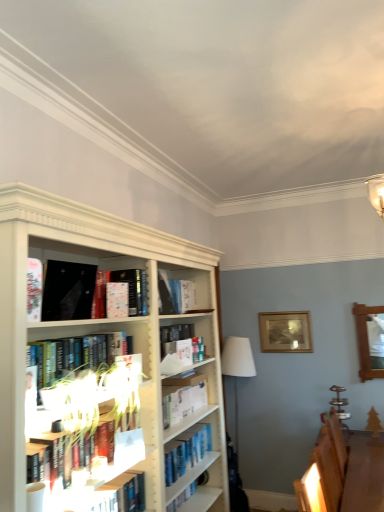
Describe the element at coordinates (285, 332) in the screenshot. I see `wooden picture frame at upper center` at that location.

Find the location of `hardcover book at center, which is the 3th book from top to bottom`. hardcover book at center, which is the 3th book from top to bottom is located at coordinates (118, 446).

Image resolution: width=384 pixels, height=512 pixels. What do you see at coordinates (127, 291) in the screenshot?
I see `hardcover book at center, which is the first book in top-to-bottom order` at bounding box center [127, 291].

Identify the location of white matte bookshelf at left, which appears as the 2th book when ordered from the bottom. (79, 355).

At what (x,y) coordinates should I click in order to perform the action: click on wooden table at lower right. Please return your answer as a coordinate pair (x, y). The image size is (384, 512). Looking at the image, I should click on (364, 472).

Find the location of `matte white paperback book at center, which ranks as the second paperback book in front-to-back order`. matte white paperback book at center, which ranks as the second paperback book in front-to-back order is located at coordinates point(117,298).

Is point (61, 276) closer or farther from the camera than point (246, 370)?

Point (61, 276).

Does matte black book at upper left, the second paperback book in the back-to-front sequence, turn towards white fabric lampshade at center?

No, matte black book at upper left, the second paperback book in the back-to-front sequence, is not aimed at white fabric lampshade at center.

Which object is positioned more to the right, matte black book at upper left, the second paperback book in the back-to-front sequence, or white fabric lampshade at center?

white fabric lampshade at center is more to the right.

Considering the relative sizes of matte black book at upper left, which is the first paperback book from front to back, and white fabric lampshade at center in the image provided, is matte black book at upper left, which is the first paperback book from front to back, wider than white fabric lampshade at center?

Incorrect, the width of matte black book at upper left, which is the first paperback book from front to back, does not surpass that of white fabric lampshade at center.

Which point is more forward, (144, 275) or (224, 358)?

The point (144, 275) is closer.

Can you confirm if hardcover book at center, which is the first book in top-to-bottom order, is thinner than white fabric lampshade at center?

Correct, the width of hardcover book at center, which is the first book in top-to-bottom order, is less than that of white fabric lampshade at center.

Looking at this image, can you confirm if hardcover book at center, which is the first book in top-to-bottom order, is taller than white fabric lampshade at center?

In fact, hardcover book at center, which is the first book in top-to-bottom order, may be shorter than white fabric lampshade at center.

Is hardcover book at center, which is the first book in top-to-bottom order, closer to the viewer compared to white fabric lampshade at center?

Yes, hardcover book at center, which is the first book in top-to-bottom order, is closer to the viewer.

From the image's perspective, which object appears higher, hardcover book at center, arranged as the 1th book when ordered from the bottom, or white fabric lampshade at center?

hardcover book at center, arranged as the 1th book when ordered from the bottom.

Consider the image. Are hardcover book at center, which is the 3th book from top to bottom, and white fabric lampshade at center far apart?

Yes, hardcover book at center, which is the 3th book from top to bottom, and white fabric lampshade at center are quite far apart.

Between point (106, 457) and point (253, 366), which one is positioned behind?

The point (253, 366) is more distant.

Considering the relative sizes of hardcover book at center, arranged as the 1th book when ordered from the bottom, and white fabric lampshade at center in the image provided, is hardcover book at center, arranged as the 1th book when ordered from the bottom, bigger than white fabric lampshade at center?

No.

Considering the positions of points (367, 510) and (114, 313), is point (367, 510) closer to camera compared to point (114, 313)?

No, (367, 510) is behind (114, 313).

The image size is (384, 512). What are the coordinates of `the 1st paperback book in front of the wooden table at lower right, counting from the anchor's position` in the screenshot? It's located at (117, 298).

Would you say wooden table at lower right is to the left or to the right of matte white paperback book at center, which ranks as the second paperback book in front-to-back order, in the picture?

From the image, it's evident that wooden table at lower right is to the right of matte white paperback book at center, which ranks as the second paperback book in front-to-back order.

From the image's perspective, which is below, white fabric lampshade at center or hardcover book at center, which is the 3th book from top to bottom?

white fabric lampshade at center is shown below in the image.

Could you tell me if white fabric lampshade at center is facing hardcover book at center, arranged as the 1th book when ordered from the bottom?

No.

How far apart are white fabric lampshade at center and hardcover book at center, which is the 3th book from top to bottom?

white fabric lampshade at center is 6.51 feet away from hardcover book at center, which is the 3th book from top to bottom.

In the scene shown: Is white fabric lampshade at center to the left of hardcover book at center, arranged as the 1th book when ordered from the bottom, from the viewer's perspective?

No, white fabric lampshade at center is not to the left of hardcover book at center, arranged as the 1th book when ordered from the bottom.

Which object is further away from the camera taking this photo, white matte bookshelf at left, which appears as the 2th book when ordered from the bottom, or wooden picture frame at upper center?

wooden picture frame at upper center is behind.

Is white matte bookshelf at left, arranged as the second book when viewed from the top, not close to wooden picture frame at upper center?

That's right, there is a large distance between white matte bookshelf at left, arranged as the second book when viewed from the top, and wooden picture frame at upper center.

From the image's perspective, which one is positioned lower, white matte bookshelf at left, arranged as the second book when viewed from the top, or wooden picture frame at upper center?

wooden picture frame at upper center.

How much distance is there between white matte bookshelf at left, which appears as the 2th book when ordered from the bottom, and wooden picture frame at upper center?

A distance of 7.37 feet exists between white matte bookshelf at left, which appears as the 2th book when ordered from the bottom, and wooden picture frame at upper center.

Could you tell me if wooden picture frame at upper center is facing matte white paperback book at center, which ranks as the second paperback book in front-to-back order?

Yes, wooden picture frame at upper center is aimed at matte white paperback book at center, which ranks as the second paperback book in front-to-back order.

Is wooden picture frame at upper center thinner than matte white paperback book at center, which ranks as the second paperback book in front-to-back order?

No.

Is wooden picture frame at upper center next to matte white paperback book at center, which ranks as the second paperback book in front-to-back order?

wooden picture frame at upper center and matte white paperback book at center, which ranks as the second paperback book in front-to-back order, are clearly separated.

Considering the sizes of wooden picture frame at upper center and matte white paperback book at center, acting as the first paperback book starting from the back, in the image, is wooden picture frame at upper center taller or shorter than matte white paperback book at center, acting as the first paperback book starting from the back,?

Clearly, wooden picture frame at upper center is taller compared to matte white paperback book at center, acting as the first paperback book starting from the back.

Identify the location of lamp behind the matte black book at upper left, which is the first paperback book from front to back. (236, 411).

Locate an element on the screen. The image size is (384, 512). book that is the 1st object to the left of the white fabric lampshade at center, starting at the anchor is located at coordinates (127, 291).

Which object lies nearer to the anchor point wooden table at lower right, hardcover book at center, which is the 3th book from top to bottom, or matte black book at upper left, the second paperback book in the back-to-front sequence?

The object closer to wooden table at lower right is hardcover book at center, which is the 3th book from top to bottom.

Looking at the image, which one is located closer to wooden table at lower right, white matte bookshelf at left, arranged as the second book when viewed from the top, or matte black book at upper left, the second paperback book in the back-to-front sequence?

Among the two, white matte bookshelf at left, arranged as the second book when viewed from the top, is located nearer to wooden table at lower right.

Which object lies nearer to the anchor point matte white paperback book at center, acting as the first paperback book starting from the back, matte black book at upper left, which is the first paperback book from front to back, or wooden picture frame at upper center?

The object closer to matte white paperback book at center, acting as the first paperback book starting from the back, is matte black book at upper left, which is the first paperback book from front to back.

Looking at the image, which one is located closer to matte white paperback book at center, acting as the first paperback book starting from the back, wooden picture frame at upper center or wooden table at lower right?

wooden table at lower right is positioned closer to the anchor matte white paperback book at center, acting as the first paperback book starting from the back.

Considering their positions, is wooden picture frame at upper center positioned further to wooden table at lower right than white fabric lampshade at center?

white fabric lampshade at center lies further to wooden table at lower right than the other object.

From the picture: From the image, which object appears to be farther from hardcover book at center, which is the first book in top-to-bottom order, hardcover book at center, which is the 3th book from top to bottom, or white fabric lampshade at center?

white fabric lampshade at center is further to hardcover book at center, which is the first book in top-to-bottom order.

Looking at the image, which one is located further to white matte bookshelf at left, arranged as the second book when viewed from the top, matte white paperback book at center, which ranks as the second paperback book in front-to-back order, or wooden picture frame at upper center?

The object further to white matte bookshelf at left, arranged as the second book when viewed from the top, is wooden picture frame at upper center.

Consider the image. Considering their positions, is matte black book at upper left, which is the first paperback book from front to back, positioned closer to hardcover book at center, the 3th book ordered from the bottom, than white fabric lampshade at center?

matte black book at upper left, which is the first paperback book from front to back.

Identify the location of lamp positioned between wooden table at lower right and wooden picture frame at upper center from near to far. (236, 411).

At what (x,y) coordinates should I click in order to perform the action: click on lamp between matte black book at upper left, the second paperback book in the back-to-front sequence, and wooden picture frame at upper center in the front-back direction. Please return your answer as a coordinate pair (x, y). Image resolution: width=384 pixels, height=512 pixels. Looking at the image, I should click on (236, 411).

This screenshot has width=384, height=512. What are the coordinates of `book between white matte bookshelf at left, which appears as the 2th book when ordered from the bottom, and hardcover book at center, the 3th book ordered from the bottom, along the z-axis` in the screenshot? It's located at (118, 446).

Where is `table between hardcover book at center, which is the first book in top-to-bottom order, and wooden picture frame at upper center, along the z-axis`? table between hardcover book at center, which is the first book in top-to-bottom order, and wooden picture frame at upper center, along the z-axis is located at coordinates (364, 472).